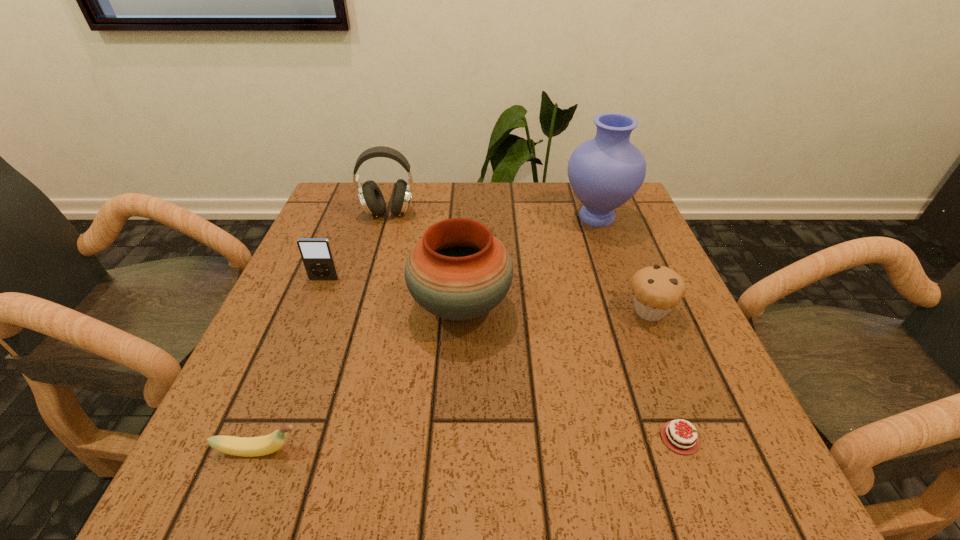
You are a GUI agent. You are given a task and a screenshot of the screen. Output one action in this format:
    pyautogui.click(x=<x>, y=<y>)
    Task: Click on the vacant space located 0.310m on the front-facing side of the iPod
    The height and width of the screenshot is (540, 960).
    Given the screenshot: What is the action you would take?
    pyautogui.click(x=274, y=404)

Where is `vacant region located 0.060m on the front of the muffin`? The image size is (960, 540). vacant region located 0.060m on the front of the muffin is located at coordinates (667, 354).

Find the location of a particular element. The width and height of the screenshot is (960, 540). vacant point located at the stem of the banana is located at coordinates (416, 451).

Find the location of a particular element. free space located 0.190m on the back of the chocolate cake is located at coordinates (636, 318).

Locate an element on the screen. The image size is (960, 540). vase that is positioned at the far edge is located at coordinates (604, 172).

The width and height of the screenshot is (960, 540). I want to click on headset that is at the far edge, so click(x=371, y=198).

Find the location of a particular element. The width and height of the screenshot is (960, 540). banana present at the near edge is located at coordinates (263, 445).

The height and width of the screenshot is (540, 960). Identify the location of chocolate cake present at the near edge. (684, 445).

At what (x,y) coordinates should I click in order to perform the action: click on headset that is at the left edge. Please return your answer as a coordinate pair (x, y). Image resolution: width=960 pixels, height=540 pixels. Looking at the image, I should click on (371, 198).

The width and height of the screenshot is (960, 540). Identify the location of iPod situated at the left edge. (x=316, y=253).